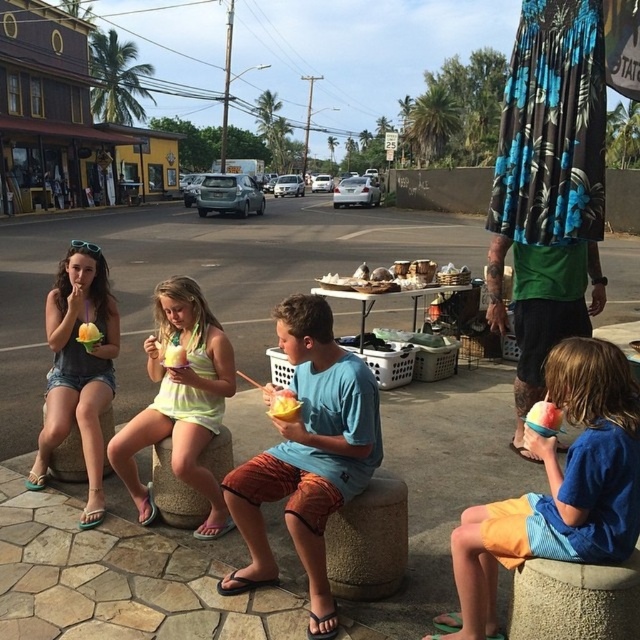
Which is above, floral fabric skirt at right or blue cotton shirt at center?

Positioned higher is floral fabric skirt at right.

Between floral fabric skirt at right and blue cotton shirt at center, which one has less height?

blue cotton shirt at center is shorter.

The height and width of the screenshot is (640, 640). What do you see at coordinates (548, 188) in the screenshot?
I see `floral fabric skirt at right` at bounding box center [548, 188].

At what (x,y) coordinates should I click in order to perform the action: click on floral fabric skirt at right. Please return your answer as a coordinate pair (x, y). This screenshot has height=640, width=640. Looking at the image, I should click on (548, 188).

What do you see at coordinates (548, 188) in the screenshot? The height and width of the screenshot is (640, 640). I see `floral fabric skirt at right` at bounding box center [548, 188].

Which is above, floral fabric skirt at right or matte gray tank top at left?

floral fabric skirt at right is above.

Does point (531, 54) come in front of point (80, 292)?

No, (531, 54) is behind (80, 292).

This screenshot has width=640, height=640. I want to click on floral fabric skirt at right, so click(548, 188).

Which is in front, point (538, 477) or point (609, 528)?

Point (609, 528) is more forward.

Is paved concrete at center to the right of blue cotton shirt at lower right from the viewer's perspective?

Correct, you'll find paved concrete at center to the right of blue cotton shirt at lower right.

Is point (44, 275) positioned behind point (554, 529)?

Yes, it is behind point (554, 529).

In order to click on paved concrete at center in this screenshot , I will do `click(196, 280)`.